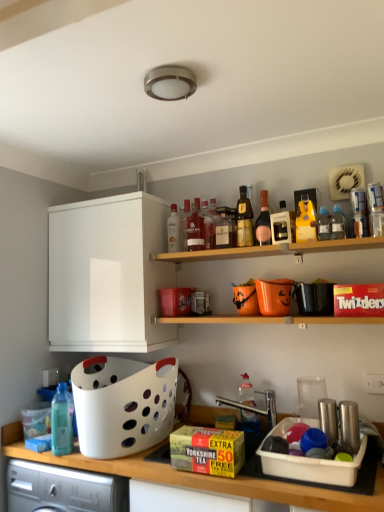
Question: Considering the relative sizes of transparent plastic bottle at lower left, the 12th bottle viewed from the right, and clear plastic bottle at upper right, the 2th bottle positioned from the right, in the image provided, is transparent plastic bottle at lower left, the 12th bottle viewed from the right, smaller than clear plastic bottle at upper right, the 2th bottle positioned from the right,?

Choices:
 (A) yes
 (B) no

Answer: (B)

Question: Is transparent plastic bottle at lower left, which appears as the 1th bottle when viewed from the left, positioned far away from clear plastic bottle at upper right, which is the 11th bottle from left to right?

Choices:
 (A) yes
 (B) no

Answer: (A)

Question: Does transparent plastic bottle at lower left, the 12th bottle viewed from the right, contain clear plastic bottle at upper right, which is the 11th bottle from left to right?

Choices:
 (A) yes
 (B) no

Answer: (B)

Question: From the image's perspective, does transparent plastic bottle at lower left, the 12th bottle viewed from the right, appear higher than clear plastic bottle at upper right, which is the 11th bottle from left to right?

Choices:
 (A) yes
 (B) no

Answer: (B)

Question: Considering the relative positions of transparent plastic bottle at lower left, which appears as the 1th bottle when viewed from the left, and clear plastic bottle at upper right, which is the 11th bottle from left to right, in the image provided, is transparent plastic bottle at lower left, which appears as the 1th bottle when viewed from the left, to the left of clear plastic bottle at upper right, which is the 11th bottle from left to right, from the viewer's perspective?

Choices:
 (A) yes
 (B) no

Answer: (A)

Question: Is clear glass bottle at center, marked as the 11th bottle in a right-to-left arrangement, wider or thinner than white matte cabinet at upper left?

Choices:
 (A) thin
 (B) wide

Answer: (A)

Question: Is clear glass bottle at center, the 2th bottle positioned from the left, situated inside white matte cabinet at upper left or outside?

Choices:
 (A) outside
 (B) inside

Answer: (A)

Question: From their relative heights in the image, would you say clear glass bottle at center, the 2th bottle positioned from the left, is taller or shorter than white matte cabinet at upper left?

Choices:
 (A) tall
 (B) short

Answer: (B)

Question: Considering their positions, is clear glass bottle at center, marked as the 11th bottle in a right-to-left arrangement, located in front of or behind white matte cabinet at upper left?

Choices:
 (A) behind
 (B) front

Answer: (A)

Question: Considering the relative positions of white plastic basket at lower left and transparent plastic bottle at lower left, which appears as the 1th bottle when viewed from the left, in the image provided, is white plastic basket at lower left to the left or to the right of transparent plastic bottle at lower left, which appears as the 1th bottle when viewed from the left,?

Choices:
 (A) left
 (B) right

Answer: (B)

Question: From a real-world perspective, is white plastic basket at lower left above or below transparent plastic bottle at lower left, which appears as the 1th bottle when viewed from the left?

Choices:
 (A) below
 (B) above

Answer: (A)

Question: Is point (170, 382) closer or farther from the camera than point (61, 430)?

Choices:
 (A) closer
 (B) farther

Answer: (B)

Question: In the image, is white plastic basket at lower left positioned in front of or behind transparent plastic bottle at lower left, the 12th bottle viewed from the right?

Choices:
 (A) front
 (B) behind

Answer: (A)

Question: Considering the positions of translucent glass bottle at center, which is counted as the fifth bottle, starting from the left, and white plastic basket at lower left in the image, is translucent glass bottle at center, which is counted as the fifth bottle, starting from the left, taller or shorter than white plastic basket at lower left?

Choices:
 (A) short
 (B) tall

Answer: (B)

Question: From the image's perspective, is translucent glass bottle at center, which is counted as the fifth bottle, starting from the left, above or below white plastic basket at lower left?

Choices:
 (A) above
 (B) below

Answer: (A)